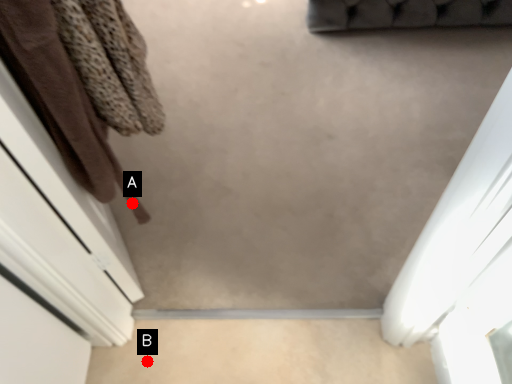
Question: Two points are circled on the image, labeled by A and B beside each circle. Which of the following is the closest to the observer?

Choices:
 (A) A is closer
 (B) B is closer

Answer: (B)